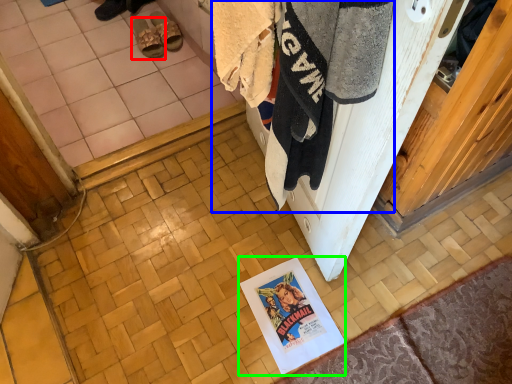
Question: Which object is positioned closest to footwear (highlighted by a red box)? Select from laundry (highlighted by a blue box) and poster page (highlighted by a green box).

Choices:
 (A) laundry
 (B) poster page

Answer: (B)